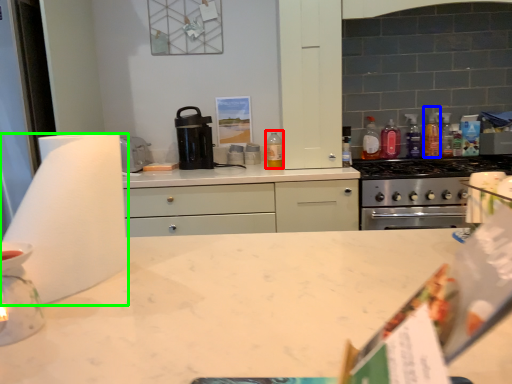
Question: Considering the real-world distances, which object is closest to bottle (highlighted by a red box)? bottle (highlighted by a blue box) or paper towel (highlighted by a green box).

Choices:
 (A) bottle
 (B) paper towel

Answer: (A)